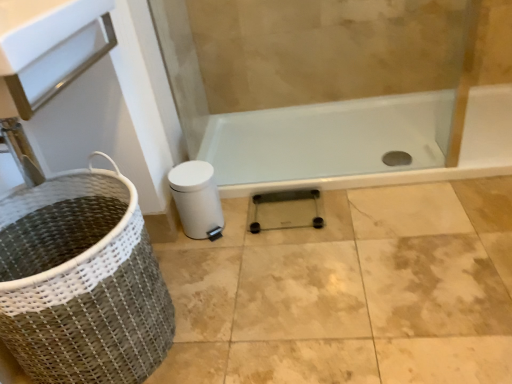
Question: From the image's perspective, is woven fabric basket at lower left above or below transparent glass scale at center?

Choices:
 (A) above
 (B) below

Answer: (B)

Question: Do you think woven fabric basket at lower left is within transparent glass scale at center, or outside of it?

Choices:
 (A) inside
 (B) outside

Answer: (B)

Question: From a real-world perspective, is woven fabric basket at lower left physically located above or below transparent glass scale at center?

Choices:
 (A) below
 (B) above

Answer: (B)

Question: Considering the positions of transparent glass scale at center and woven fabric basket at lower left in the image, is transparent glass scale at center bigger or smaller than woven fabric basket at lower left?

Choices:
 (A) big
 (B) small

Answer: (B)

Question: Is point (331, 223) positioned closer to the camera than point (124, 294)?

Choices:
 (A) farther
 (B) closer

Answer: (A)

Question: Considering the positions of transparent glass scale at center and woven fabric basket at lower left in the image, is transparent glass scale at center wider or thinner than woven fabric basket at lower left?

Choices:
 (A) wide
 (B) thin

Answer: (B)

Question: Which is correct: transparent glass scale at center is inside woven fabric basket at lower left, or outside of it?

Choices:
 (A) inside
 (B) outside

Answer: (B)